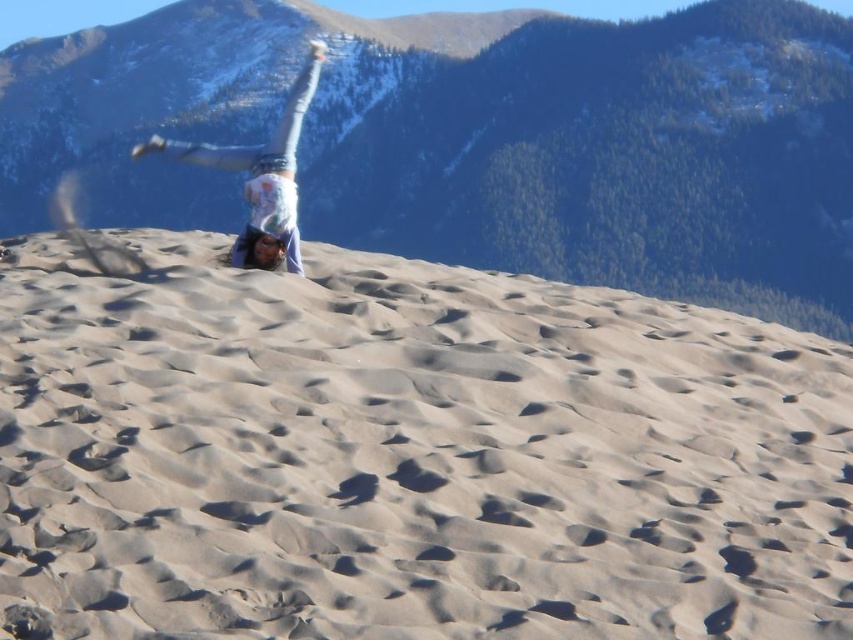
Question: Is smooth beige sand at center further to camera compared to green forested mountain at upper center?

Choices:
 (A) yes
 (B) no

Answer: (B)

Question: Does smooth beige sand at center come behind green forested mountain at upper center?

Choices:
 (A) yes
 (B) no

Answer: (B)

Question: Is green forested mountain at upper center bigger than light blue denim jeans at upper center?

Choices:
 (A) no
 (B) yes

Answer: (B)

Question: Which object is closer to the camera taking this photo?

Choices:
 (A) smooth beige sand at center
 (B) light blue denim jeans at upper center
 (C) green forested mountain at upper center

Answer: (A)

Question: Which point is farther to the camera?

Choices:
 (A) light blue denim jeans at upper center
 (B) green forested mountain at upper center

Answer: (B)

Question: Which of the following is the closest to the observer?

Choices:
 (A) (263, 230)
 (B) (810, 492)
 (C) (224, 36)

Answer: (B)